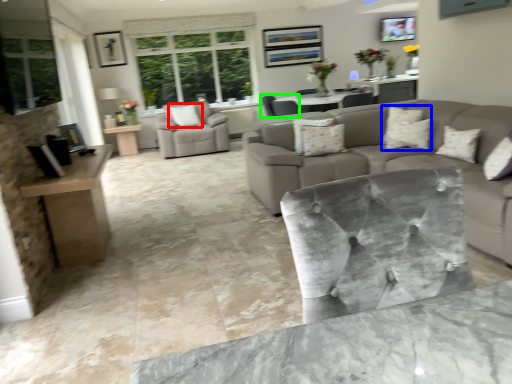
Question: Considering the real-world distances, which object is farthest from pillow (highlighted by a red box)? pillow (highlighted by a blue box) or chair (highlighted by a green box)?

Choices:
 (A) pillow
 (B) chair

Answer: (A)